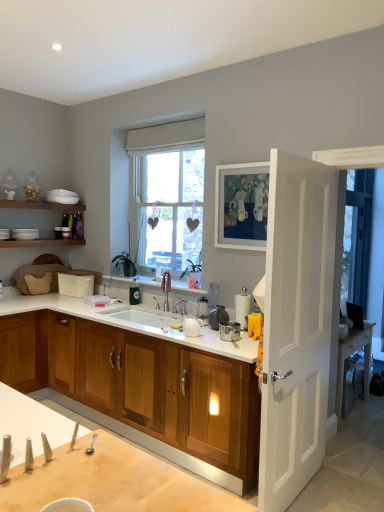
Measure the distance between point (222, 413) and camera.

Point (222, 413) is 8.77 feet from camera.

This screenshot has height=512, width=384. What do you see at coordinates (357, 238) in the screenshot?
I see `transparent glass door at right` at bounding box center [357, 238].

Describe the element at coordinates (143, 319) in the screenshot. I see `white glossy sink at center` at that location.

Find the location of a particular element. This screenshot has width=384, height=512. white wooden door at right is located at coordinates (297, 323).

Locate an element on the screen. wooden cabinet at center is located at coordinates (142, 389).

What are the coordinates of `countertop located above the white glossy sink at center (from a real-world perspective)` in the screenshot? It's located at (130, 321).

Which object is wider, white glossy countertop at center or white glossy sink at center?

white glossy countertop at center.

In terms of height, does white glossy countertop at center look taller or shorter compared to white glossy sink at center?

white glossy countertop at center is shorter than white glossy sink at center.

Is white glossy countertop at center turned away from white glossy sink at center?

No, white glossy countertop at center is not facing away from white glossy sink at center.

Is white matte picture frame at upper center wider or thinner than white wooden door at right?

In the image, white matte picture frame at upper center appears to be more narrow than white wooden door at right.

Considering the positions of objects white matte picture frame at upper center and white wooden door at right in the image provided, who is more to the right, white matte picture frame at upper center or white wooden door at right?

Positioned to the right is white wooden door at right.

Considering the relative positions of white matte picture frame at upper center and white wooden door at right in the image provided, is white matte picture frame at upper center behind white wooden door at right?

Yes, white matte picture frame at upper center is behind white wooden door at right.

Consider the image. Between white matte picture frame at upper center and white wooden door at right, which one has smaller size?

white matte picture frame at upper center is smaller.

Considering the sizes of objects transparent glass door at right and white matte picture frame at upper center in the image provided, who is shorter, transparent glass door at right or white matte picture frame at upper center?

Standing shorter between the two is white matte picture frame at upper center.

Considering the sizes of objects transparent glass door at right and white matte picture frame at upper center in the image provided, who is thinner, transparent glass door at right or white matte picture frame at upper center?

white matte picture frame at upper center.

Is transparent glass door at right aimed at white matte picture frame at upper center?

No, transparent glass door at right does not turn towards white matte picture frame at upper center.

Which is correct: transparent glass door at right is inside white matte picture frame at upper center, or outside of it?

transparent glass door at right is spatially situated outside white matte picture frame at upper center.

Is white glossy countertop at center at the back of white matte picture frame at upper center?

white matte picture frame at upper center is not turned away from white glossy countertop at center.

Is white matte picture frame at upper center to the left or to the right of white glossy countertop at center in the image?

Clearly, white matte picture frame at upper center is on the right of white glossy countertop at center in the image.

Considering the relative sizes of white matte picture frame at upper center and white glossy countertop at center in the image provided, is white matte picture frame at upper center bigger than white glossy countertop at center?

No, white matte picture frame at upper center is not bigger than white glossy countertop at center.

Considering the sizes of objects white matte picture frame at upper center and white glossy countertop at center in the image provided, who is taller, white matte picture frame at upper center or white glossy countertop at center?

Standing taller between the two is white matte picture frame at upper center.

Identify the location of door on the right side of white glossy sink at center. This screenshot has width=384, height=512. (297, 323).

Considering the positions of objects white glossy sink at center and white wooden door at right in the image provided, who is more to the left, white glossy sink at center or white wooden door at right?

Positioned to the left is white glossy sink at center.

Considering the positions of objects white glossy sink at center and white wooden door at right in the image provided, who is behind, white glossy sink at center or white wooden door at right?

white glossy sink at center.

Is white glossy sink at center far from white wooden door at right?

Yes, white glossy sink at center and white wooden door at right are located far from each other.

Where is `window screen located on the right of white wooden door at right`? window screen located on the right of white wooden door at right is located at coordinates (357, 238).

Is transparent glass door at right positioned far away from white wooden door at right?

Yes, transparent glass door at right and white wooden door at right are quite far apart.

Considering the positions of objects transparent glass door at right and white wooden door at right in the image provided, who is more to the left, transparent glass door at right or white wooden door at right?

Positioned to the left is white wooden door at right.

Would you consider transparent glass door at right to be distant from white glossy countertop at center?

Yes, transparent glass door at right is far from white glossy countertop at center.

At what (x,y) coordinates should I click in order to perform the action: click on countertop below the transparent glass door at right (from a real-world perspective). Please return your answer as a coordinate pair (x, y). Image resolution: width=384 pixels, height=512 pixels. Looking at the image, I should click on (130, 321).

From a real-world perspective, is transparent glass door at right below white glossy countertop at center?

No, from a real-world perspective, transparent glass door at right is not beneath white glossy countertop at center.

Considering the positions of objects transparent glass door at right and white glossy countertop at center in the image provided, who is more to the right, transparent glass door at right or white glossy countertop at center?

transparent glass door at right is more to the right.

Find the location of a particular element. The height and width of the screenshot is (512, 384). sink located behind the white glossy countertop at center is located at coordinates (143, 319).

Find the location of a particular element. picture frame above the white wooden door at right (from a real-world perspective) is located at coordinates (241, 205).

Looking at the image, which one is located further to white matte picture frame at upper center, white wooden door at right or white glossy countertop at center?

Among the two, white glossy countertop at center is located further to white matte picture frame at upper center.

Estimate the real-world distances between objects in this image. Which object is further from white glossy countertop at center, white glossy sink at center or wooden cabinet at center?

wooden cabinet at center is further to white glossy countertop at center.

Estimate the real-world distances between objects in this image. Which object is further from wooden cabinet at center, white glossy countertop at center or white wooden door at right?

The object further to wooden cabinet at center is white wooden door at right.

From the image, which object appears to be nearer to wooden cabinet at center, transparent glass door at right or white matte picture frame at upper center?

Among the two, white matte picture frame at upper center is located nearer to wooden cabinet at center.

Based on their spatial positions, is white glossy countertop at center or wooden cabinet at center closer to white matte picture frame at upper center?

Among the two, white glossy countertop at center is located nearer to white matte picture frame at upper center.

From the image, which object appears to be farther from transparent glass door at right, white matte picture frame at upper center or wooden cabinet at center?

wooden cabinet at center lies further to transparent glass door at right than the other object.

Which object lies nearer to the anchor point white matte picture frame at upper center, white glossy countertop at center or white wooden door at right?

white wooden door at right is closer to white matte picture frame at upper center.

From the image, which object appears to be farther from wooden cabinet at center, white matte picture frame at upper center or white glossy sink at center?

Based on the image, white matte picture frame at upper center appears to be further to wooden cabinet at center.

The width and height of the screenshot is (384, 512). In order to click on picture frame between white wooden door at right and white glossy sink at center from front to back in this screenshot , I will do `click(241, 205)`.

Identify the location of cabinetry situated between white glossy sink at center and transparent glass door at right from left to right. This screenshot has height=512, width=384. click(x=142, y=389).

Identify the location of sink located between white wooden door at right and transparent glass door at right in the depth direction. This screenshot has height=512, width=384. (143, 319).

Identify the location of door between white matte picture frame at upper center and wooden cabinet at center vertically. This screenshot has height=512, width=384. (297, 323).